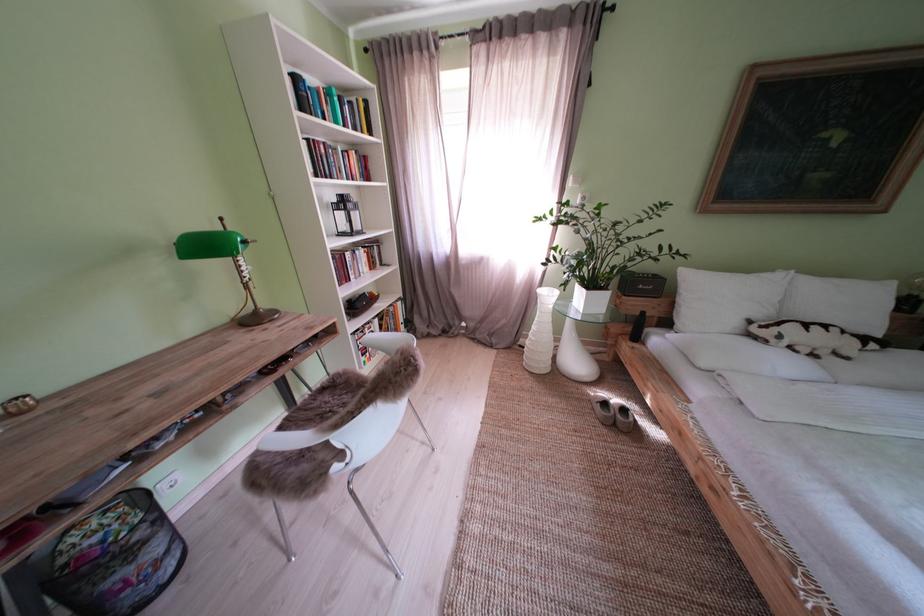
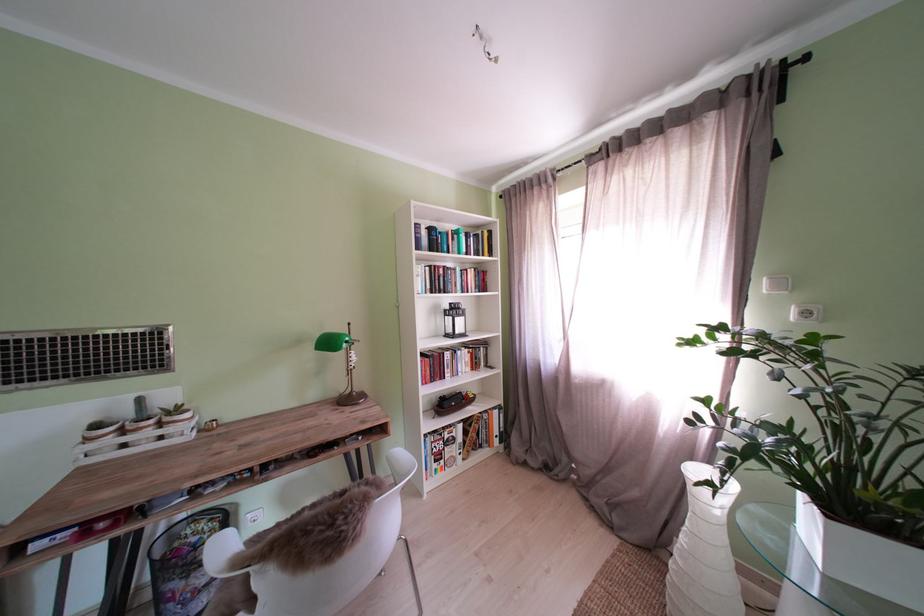
Where in the second image is the point corresponding to pixel 374 331 from the first image?

(456, 434)